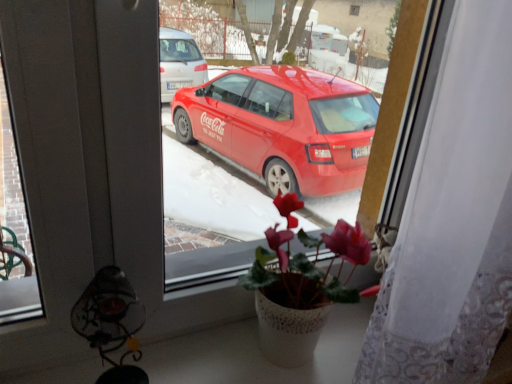
Where is `free spot to the right of metallic wire lamp at lower left`? The image size is (512, 384). free spot to the right of metallic wire lamp at lower left is located at coordinates (210, 359).